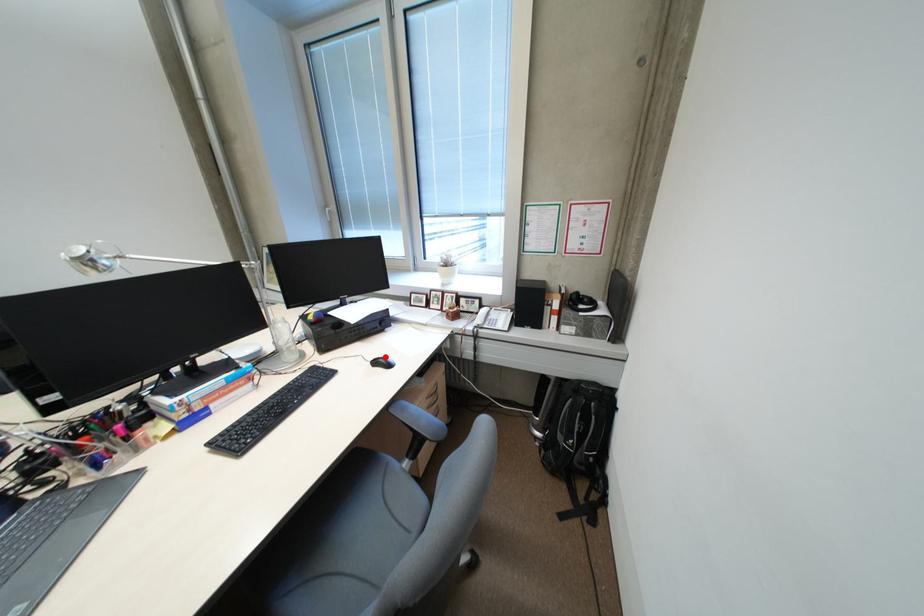
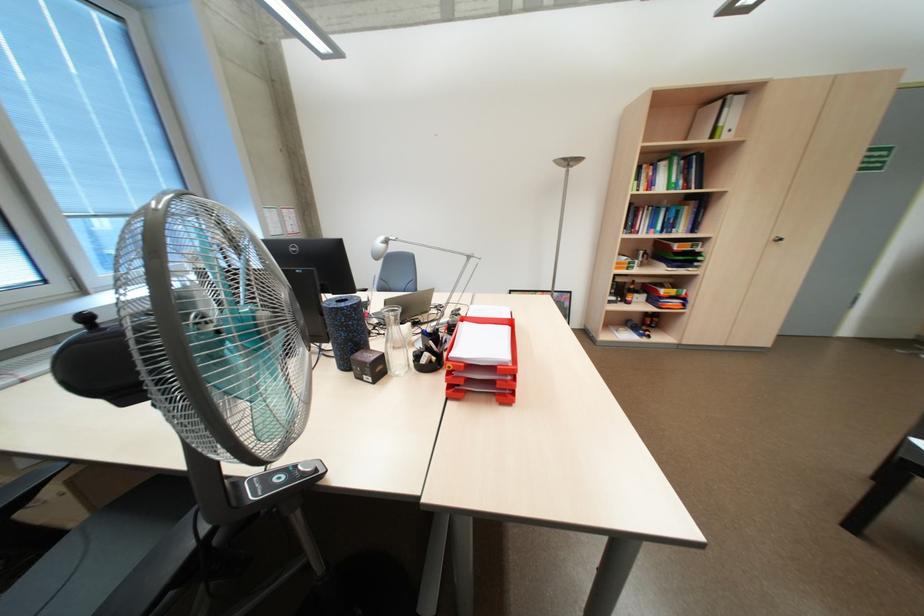
Question: I am providing you with two images of the same scene from different viewpoints. A red point is marked on the first image. At the location where the point appears in image 1, is it still visible in image 2?

Choices:
 (A) Yes
 (B) No

Answer: (B)